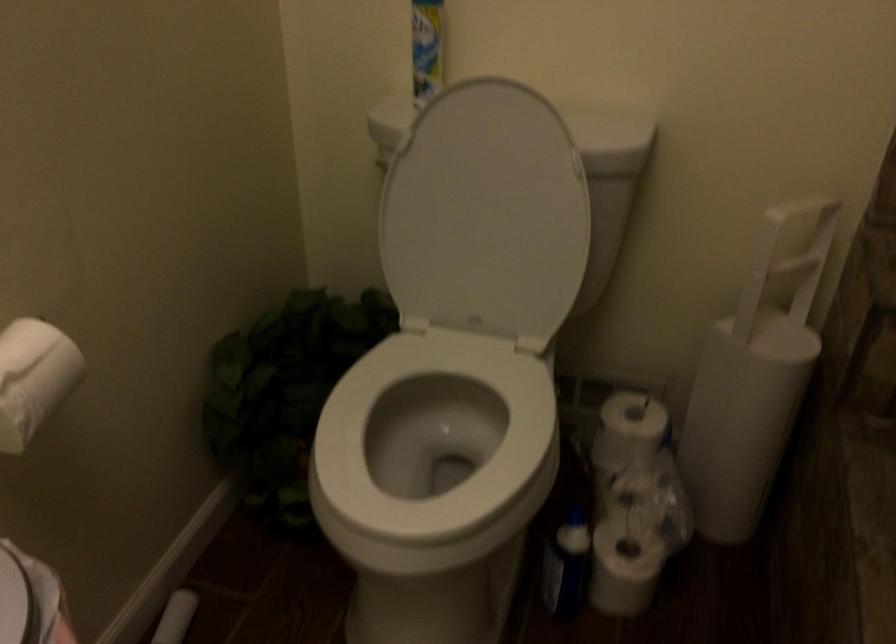
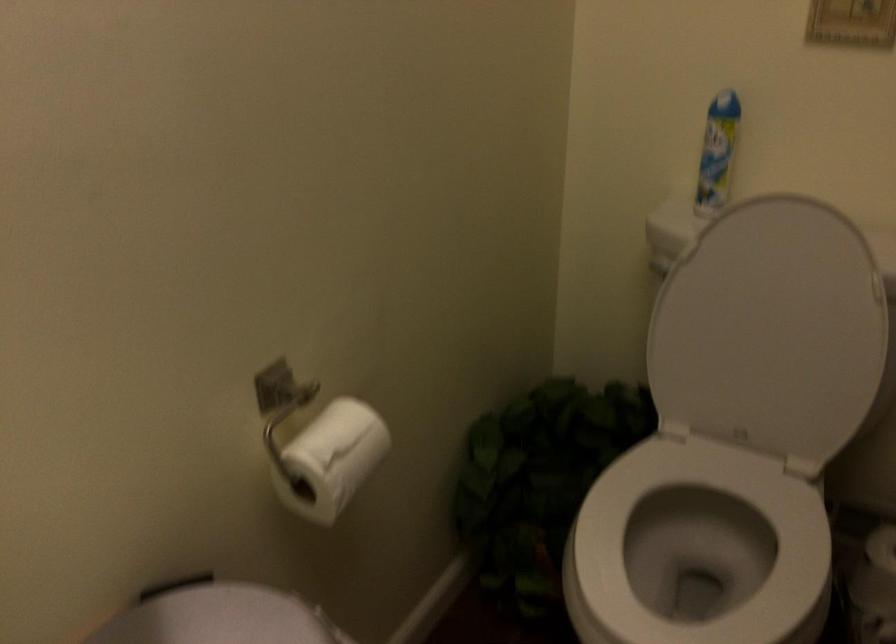
The point at (452, 436) is marked in the first image. Where is the corresponding point in the second image?

(698, 547)